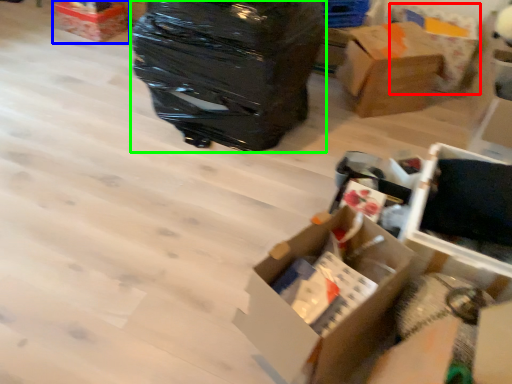
Question: Estimate the real-world distances between objects in this image. Which object is closer to cardboard box (highlighted by a red box), box (highlighted by a blue box) or garbage (highlighted by a green box)?

Choices:
 (A) box
 (B) garbage

Answer: (B)